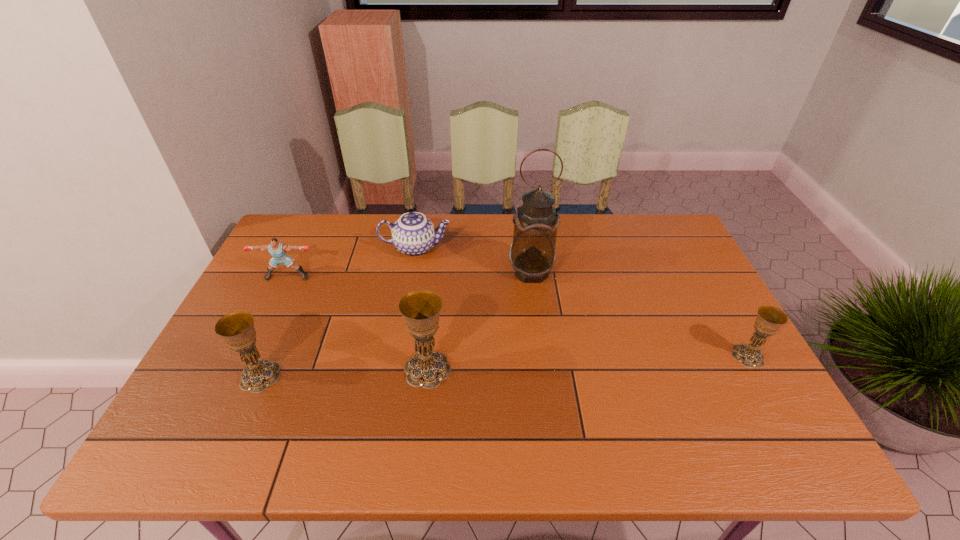
Locate an element on the screen. This screenshot has width=960, height=540. object situated at the near left corner is located at coordinates (237, 329).

In the image, there is a desktop. In order to click on vacant space at the far edge in this screenshot , I will do `click(573, 245)`.

The height and width of the screenshot is (540, 960). Find the location of `vacant space at the near edge`. vacant space at the near edge is located at coordinates (353, 410).

The width and height of the screenshot is (960, 540). I want to click on vacant space at the right edge of the desktop, so click(x=654, y=264).

Identify the location of vacant region at the far left corner of the desktop. Image resolution: width=960 pixels, height=540 pixels. (299, 220).

Find the location of a particular element. free region at the near left corner of the desktop is located at coordinates (228, 402).

This screenshot has height=540, width=960. Identify the location of free location at the near right corner of the desktop. (711, 385).

Where is `free space between the puncher and the chinaware`? free space between the puncher and the chinaware is located at coordinates (351, 262).

I want to click on free spot between the leftmost chalice and the second object from right to left, so click(396, 324).

At what (x,y) coordinates should I click in order to perform the action: click on free space between the shortest chalice and the puncher. Please return your answer as a coordinate pair (x, y). Image resolution: width=960 pixels, height=540 pixels. Looking at the image, I should click on (517, 316).